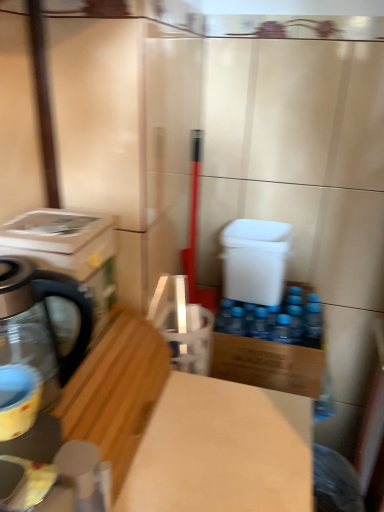
Question: From the image's perspective, does white plastic water cooler at center appear higher than light brown wood at center?

Choices:
 (A) yes
 (B) no

Answer: (A)

Question: Does white plastic water cooler at center have a smaller size compared to light brown wood at center?

Choices:
 (A) yes
 (B) no

Answer: (A)

Question: Would you consider white plastic water cooler at center to be distant from light brown wood at center?

Choices:
 (A) yes
 (B) no

Answer: (B)

Question: Is white plastic water cooler at center facing away from light brown wood at center?

Choices:
 (A) yes
 (B) no

Answer: (B)

Question: Is white plastic water cooler at center located outside light brown wood at center?

Choices:
 (A) yes
 (B) no

Answer: (A)

Question: From a real-world perspective, is white plastic water cooler at center located higher than light brown wood at center?

Choices:
 (A) no
 (B) yes

Answer: (B)

Question: Is white glossy washing machine at left in contact with matte yellow cup at left?

Choices:
 (A) no
 (B) yes

Answer: (A)

Question: Is matte yellow cup at left located within white glossy washing machine at left?

Choices:
 (A) yes
 (B) no

Answer: (B)

Question: Is the depth of white glossy washing machine at left greater than that of matte yellow cup at left?

Choices:
 (A) no
 (B) yes

Answer: (B)

Question: Does white glossy washing machine at left lie in front of matte yellow cup at left?

Choices:
 (A) no
 (B) yes

Answer: (A)

Question: Could you tell me if white glossy washing machine at left is facing matte yellow cup at left?

Choices:
 (A) yes
 (B) no

Answer: (B)

Question: Is white glossy washing machine at left at the right side of matte yellow cup at left?

Choices:
 (A) yes
 (B) no

Answer: (B)

Question: Is white plastic water cooler at center taller than wooden cutting board at lower left?

Choices:
 (A) no
 (B) yes

Answer: (B)